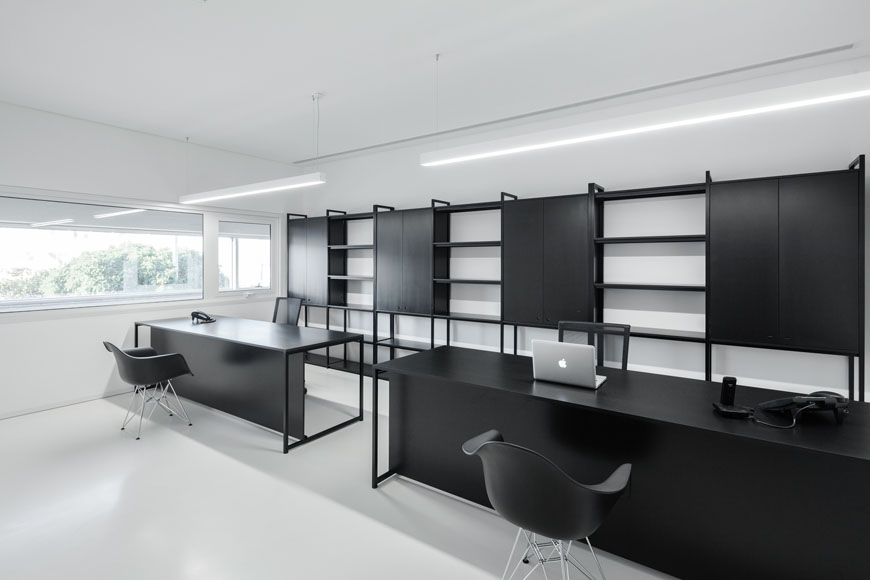
Locate an element on the screen. chair is located at coordinates (139, 372).